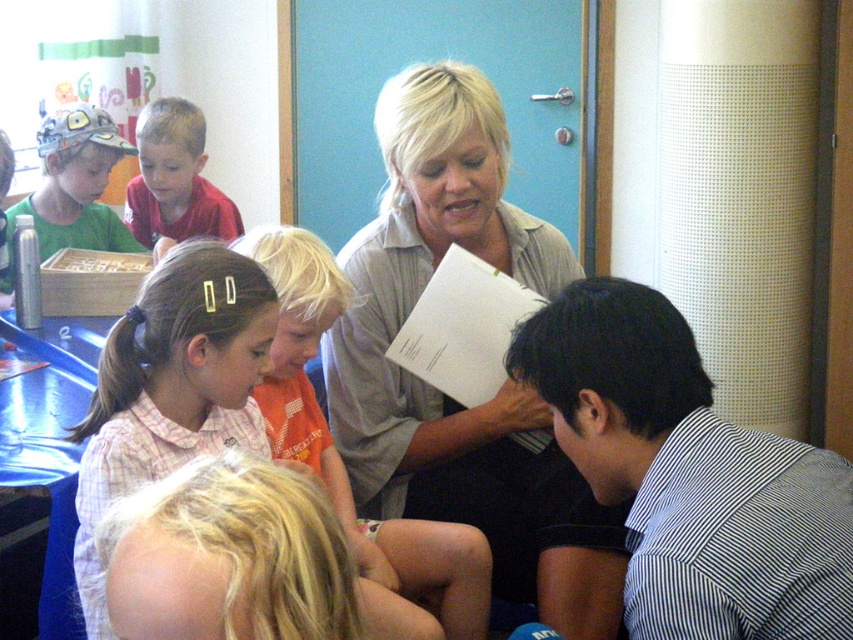
Question: Which object appears farthest from the camera in this image?

Choices:
 (A) light beige shirt at center
 (B) orange cotton shirt at center
 (C) matte red shirt at upper left

Answer: (C)

Question: Does light beige shirt at center lie in front of black striped shirt at lower right?

Choices:
 (A) no
 (B) yes

Answer: (A)

Question: In this image, where is black striped shirt at lower right located relative to matte red shirt at upper left?

Choices:
 (A) right
 (B) left

Answer: (A)

Question: Can you confirm if black striped shirt at lower right is positioned to the left of matte red shirt at upper left?

Choices:
 (A) no
 (B) yes

Answer: (A)

Question: Which point is farther from the camera taking this photo?

Choices:
 (A) (378, 580)
 (B) (834, 627)

Answer: (A)

Question: Which of the following is the closest to the observer?

Choices:
 (A) black striped shirt at lower right
 (B) light beige shirt at center
 (C) matte red shirt at upper left
 (D) orange cotton shirt at center

Answer: (A)